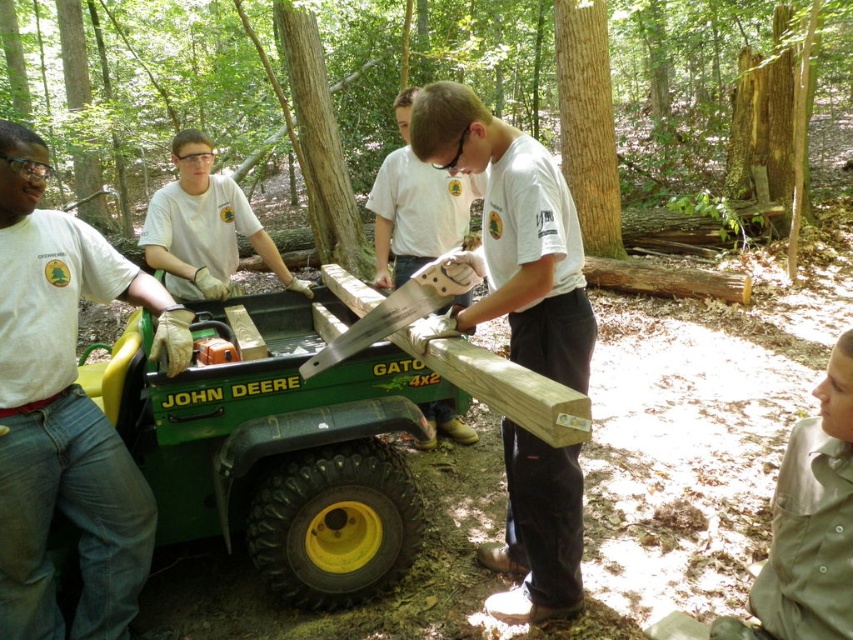
You are a photographer taking a picture of the scene. You want to focus on the white matte shirt at upper center and denim jeans at left. Which one should you adjust the camera focus on first if you want to ensure both are in focus?

The denim jeans at left is below the white matte shirt at upper center, so you should focus on the white matte shirt at upper center first as it is closer to the camera.

You are a photographer trying to capture a candid shot of the person working on the wooden plank. Since you want to focus on their lower body, which object should you adjust your camera angle to prioritize between the denim jeans at left and the white matte shirt at upper center?

The denim jeans at left is much taller than the white matte shirt at upper center, so you should adjust your camera angle to prioritize the denim jeans at left for focusing on the lower body.

You are a photographer trying to capture a candid shot of the person working on the wooden plank. You notice the denim jeans at left and the white matte shirt at upper center in your viewfinder. Which clothing item takes up more area in the photo?

The white matte shirt at upper center occupies more space than the denim jeans at left in the photo.